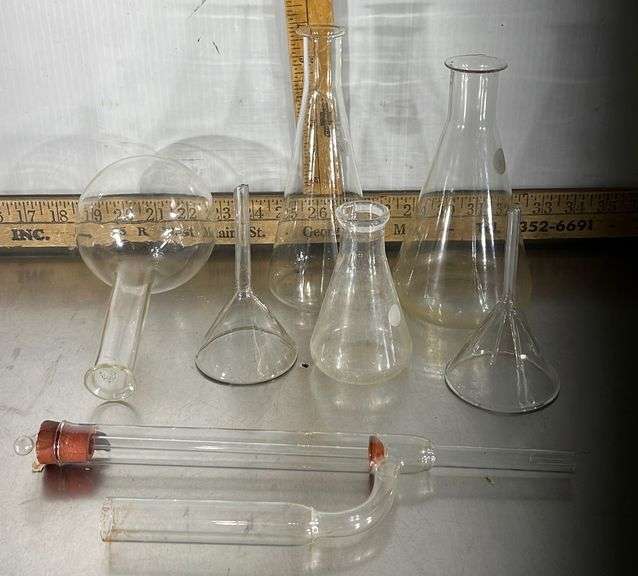
This screenshot has width=638, height=576. Find the location of `flask`. flask is located at coordinates (299, 278).